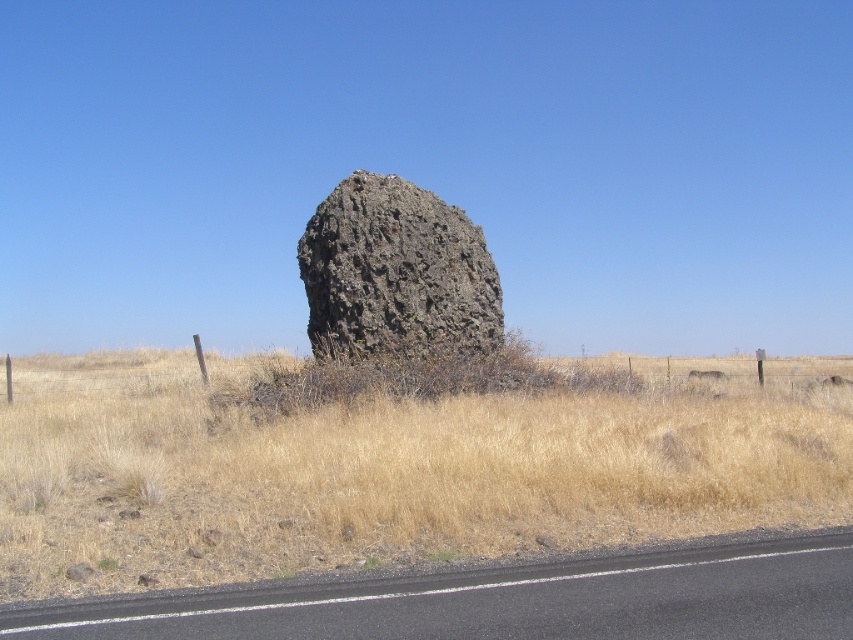
You are standing at the base of the large dark rock formation and want to walk towards the point that is closer to you. Which point should you head towards, point (45, 573) or point (325, 208)?

You should head towards point (45, 573) because it is closer to the viewer than point (325, 208).